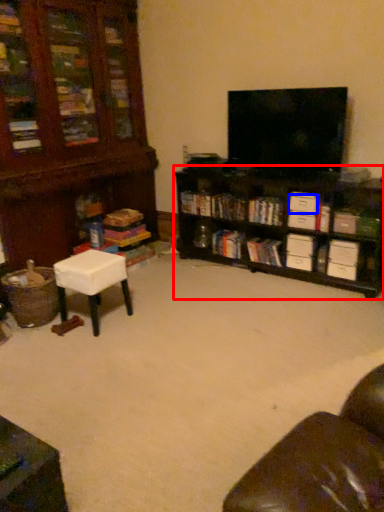
Question: Among these objects, which one is farthest to the camera, shelf (highlighted by a red box) or drawer (highlighted by a blue box)?

Choices:
 (A) shelf
 (B) drawer

Answer: (B)